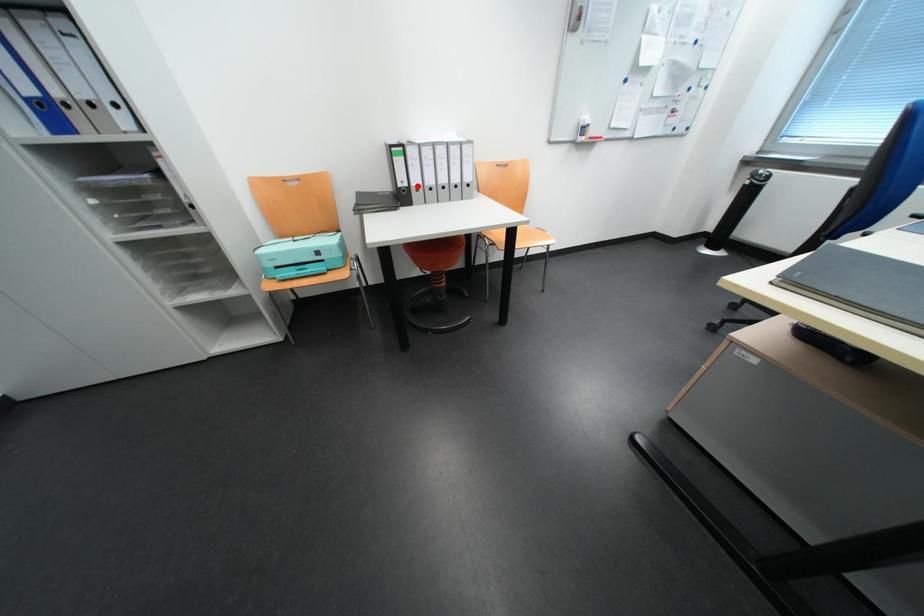
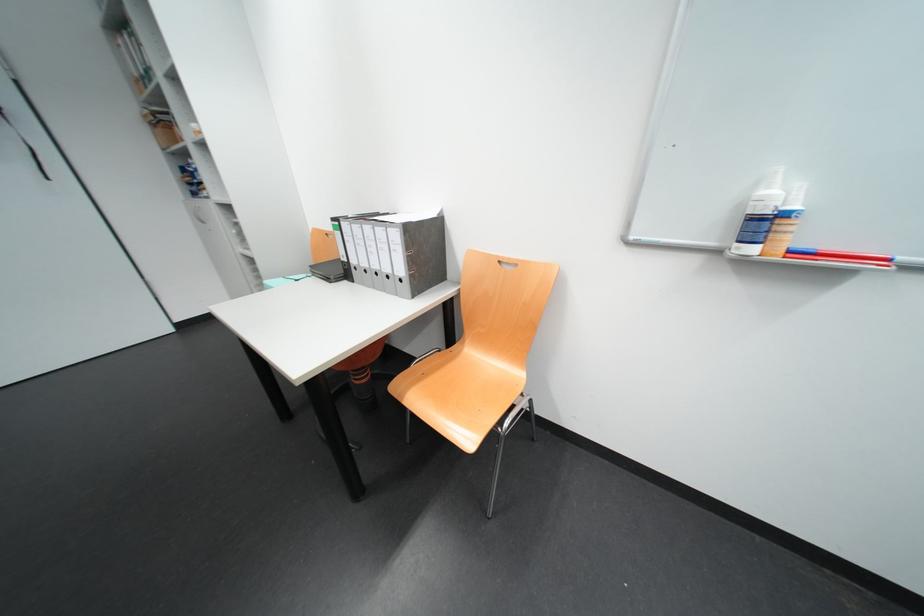
Question: I am providing you with two images of the same scene from different viewpoints. Image1 has a red point marked. In image2, the corresponding 3D location appears at what relative position? Reply with the corresponding letter.

Choices:
 (A) Closer
 (B) Farther

Answer: (B)